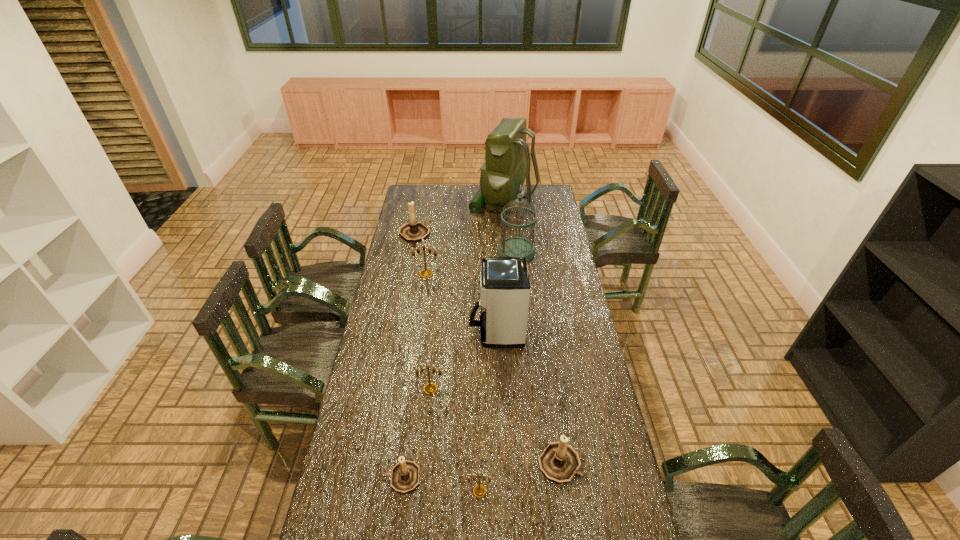
Where is `backpack`? Image resolution: width=960 pixels, height=540 pixels. backpack is located at coordinates (507, 163).

Locate an element on the screen. The height and width of the screenshot is (540, 960). green backpack is located at coordinates (507, 163).

At what (x,y) coordinates should I click in order to perform the action: click on birdcage. Please return your answer as a coordinate pair (x, y). This screenshot has height=540, width=960. Looking at the image, I should click on (511, 246).

Find the location of a particular element. the fifth farthest object is located at coordinates (504, 282).

Locate an element on the screen. The height and width of the screenshot is (540, 960). the farthest candelabrum is located at coordinates [413, 231].

Locate an element on the screen. The height and width of the screenshot is (540, 960). the biggest brown candle holder is located at coordinates (413, 231).

Locate an element on the screen. The image size is (960, 540). the farthest gold candelabrum is located at coordinates (425, 273).

Find the location of a particular element. The height and width of the screenshot is (540, 960). the biggest gold candelabrum is located at coordinates (425, 273).

The image size is (960, 540). I want to click on the fourth nearest object, so click(430, 388).

Where is `the second farthest gold candelabrum`? Image resolution: width=960 pixels, height=540 pixels. the second farthest gold candelabrum is located at coordinates (430, 388).